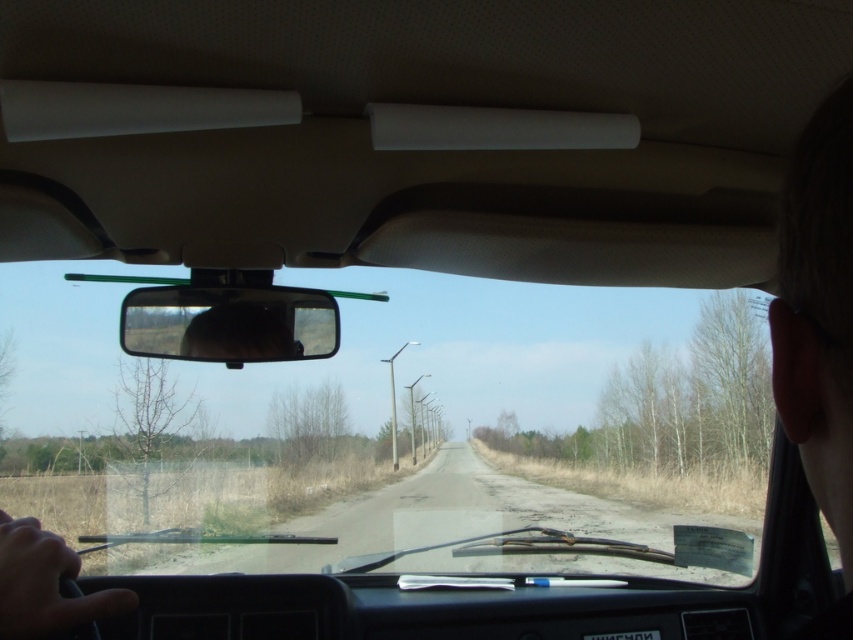
Question: Among these points, which one is nearest to the camera?

Choices:
 (A) (718, 348)
 (B) (288, 353)

Answer: (B)

Question: Among these objects, which one is nearest to the camera?

Choices:
 (A) transparent glass windshield at center
 (B) black glossy rearview mirror at center

Answer: (A)

Question: Does transparent glass windshield at center appear on the left side of black glossy rearview mirror at center?

Choices:
 (A) no
 (B) yes

Answer: (A)

Question: Does transparent glass windshield at center appear on the right side of black glossy rearview mirror at center?

Choices:
 (A) no
 (B) yes

Answer: (B)

Question: Can you confirm if transparent glass windshield at center is wider than black glossy rearview mirror at center?

Choices:
 (A) yes
 (B) no

Answer: (A)